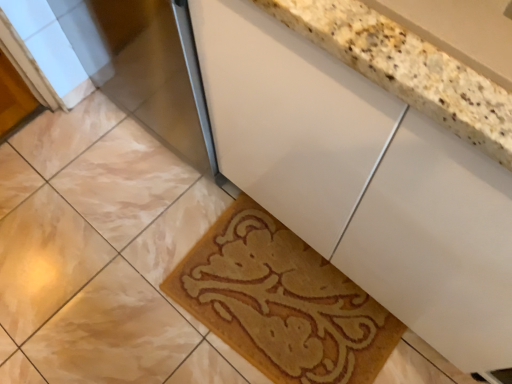
In order to click on free spot below beige textured bath mat at lower center (from a real-world perspective) in this screenshot , I will do `click(274, 309)`.